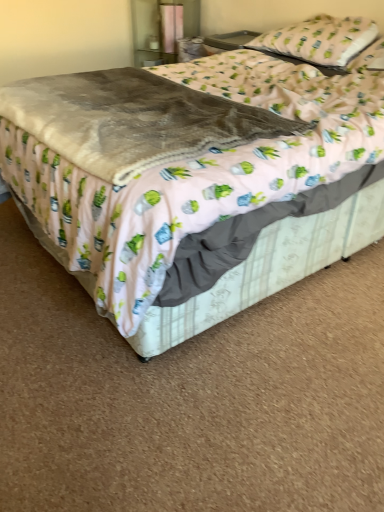
Question: Considering the relative sizes of velvet gray blanket at center and velvety gray blanket at center in the image provided, is velvet gray blanket at center bigger than velvety gray blanket at center?

Choices:
 (A) no
 (B) yes

Answer: (B)

Question: Does velvet gray blanket at center turn towards velvety gray blanket at center?

Choices:
 (A) no
 (B) yes

Answer: (A)

Question: Is velvet gray blanket at center shorter than velvety gray blanket at center?

Choices:
 (A) no
 (B) yes

Answer: (A)

Question: Is velvet gray blanket at center outside of velvety gray blanket at center?

Choices:
 (A) no
 (B) yes

Answer: (B)

Question: From a real-world perspective, is velvet gray blanket at center on velvety gray blanket at center?

Choices:
 (A) yes
 (B) no

Answer: (B)

Question: Considering the positions of white fabric pillow at upper right, which is counted as the second pillow, starting from the top, and velvet gray blanket at center in the image, is white fabric pillow at upper right, which is counted as the second pillow, starting from the top, wider or thinner than velvet gray blanket at center?

Choices:
 (A) wide
 (B) thin

Answer: (B)

Question: From a real-world perspective, relative to velvet gray blanket at center, is white fabric pillow at upper right, positioned as the 1th pillow in bottom-to-top order, vertically above or below?

Choices:
 (A) below
 (B) above

Answer: (B)

Question: Is white fabric pillow at upper right, positioned as the 1th pillow in bottom-to-top order, spatially inside velvet gray blanket at center, or outside of it?

Choices:
 (A) outside
 (B) inside

Answer: (B)

Question: Is white fabric pillow at upper right, positioned as the 1th pillow in bottom-to-top order, taller or shorter than velvet gray blanket at center?

Choices:
 (A) tall
 (B) short

Answer: (B)

Question: Would you say velvet gray blanket at center is inside or outside velvety gray blanket at center?

Choices:
 (A) inside
 (B) outside

Answer: (B)

Question: Based on their positions, is velvet gray blanket at center located to the left or right of velvety gray blanket at center?

Choices:
 (A) right
 (B) left

Answer: (A)

Question: From the image's perspective, is velvet gray blanket at center positioned above or below velvety gray blanket at center?

Choices:
 (A) below
 (B) above

Answer: (A)

Question: Relative to velvety gray blanket at center, is velvet gray blanket at center in front or behind?

Choices:
 (A) behind
 (B) front

Answer: (B)

Question: Which is correct: velvety gray blanket at center is inside white fabric pillow at upper right, which is counted as the second pillow, starting from the top, or outside of it?

Choices:
 (A) inside
 (B) outside

Answer: (B)

Question: Is point (132, 130) closer or farther from the camera than point (379, 44)?

Choices:
 (A) closer
 (B) farther

Answer: (A)